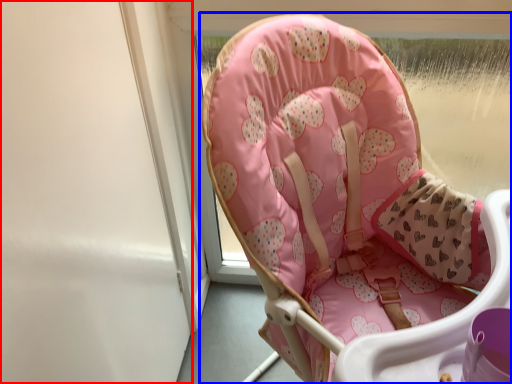
Question: Which object appears closest to the camera in this image, screen door (highlighted by a red box) or chair (highlighted by a blue box)?

Choices:
 (A) screen door
 (B) chair

Answer: (B)